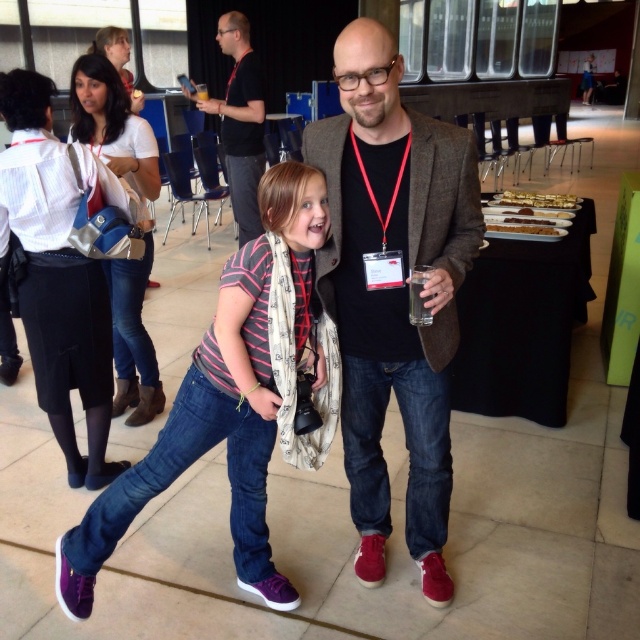
You are organizing a photo shoot and need to ensure that the clothing items in the image are arranged properly. Given the brown woolen jacket at center and the denim jeans at left, which clothing item takes up less space in the scene?

The brown woolen jacket at center occupies less space than the denim jeans at left, so the brown woolen jacket at center takes up less space in the scene.